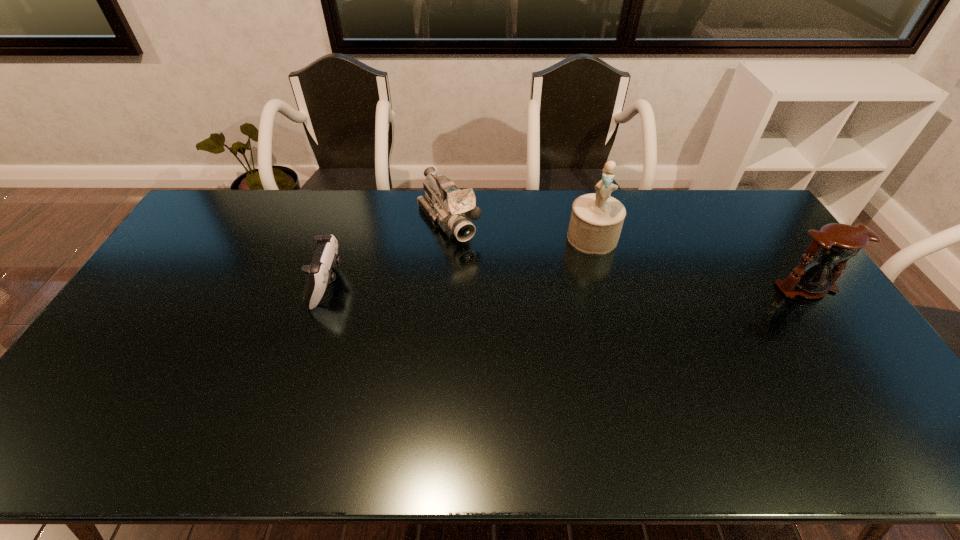
Where is `vacant area located 0.400m at the beak of the tallest object`? The height and width of the screenshot is (540, 960). vacant area located 0.400m at the beak of the tallest object is located at coordinates (573, 350).

At what (x,y) coordinates should I click in order to perform the action: click on vacant space located 0.200m on the front-facing side of the camcorder. Please return your answer as a coordinate pair (x, y). Looking at the image, I should click on (492, 284).

The width and height of the screenshot is (960, 540). Find the location of `vacant space situated on the front-facing side of the camcorder`. vacant space situated on the front-facing side of the camcorder is located at coordinates (514, 313).

The width and height of the screenshot is (960, 540). In order to click on vacant space located on the front-facing side of the camcorder in this screenshot , I will do `click(477, 265)`.

Locate an element on the screen. figurine that is at the far edge is located at coordinates (596, 221).

Locate an element on the screen. camcorder that is at the far edge is located at coordinates (445, 205).

Image resolution: width=960 pixels, height=540 pixels. I want to click on object that is at the right edge, so click(x=836, y=243).

The image size is (960, 540). Identify the location of free spot at the far edge of the desktop. (424, 198).

Identify the location of vacant space at the near edge. This screenshot has width=960, height=540. (447, 384).

In the image, there is a desktop. Find the location of `vacant space at the left edge`. vacant space at the left edge is located at coordinates (99, 354).